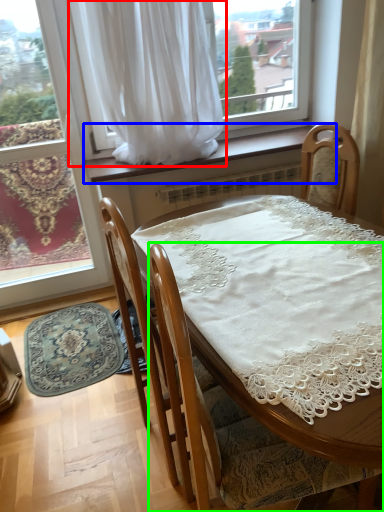
Question: Based on their relative distances, which object is farther from curtain (highlighted by a red box)? Choose from window sill (highlighted by a blue box) and chair (highlighted by a green box).

Choices:
 (A) window sill
 (B) chair

Answer: (B)